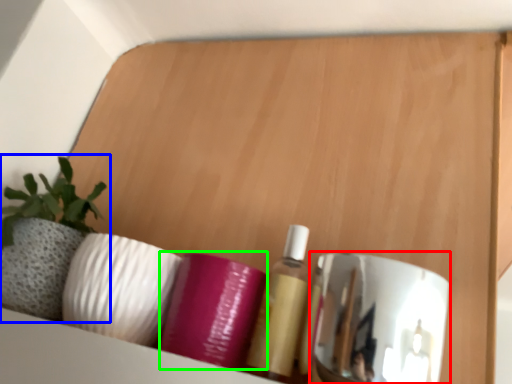
Question: Estimate the real-world distances between objects in this image. Which object is farther from mirror (highlighted by a red box), houseplant (highlighted by a blue box) or toiletry (highlighted by a green box)?

Choices:
 (A) houseplant
 (B) toiletry

Answer: (A)